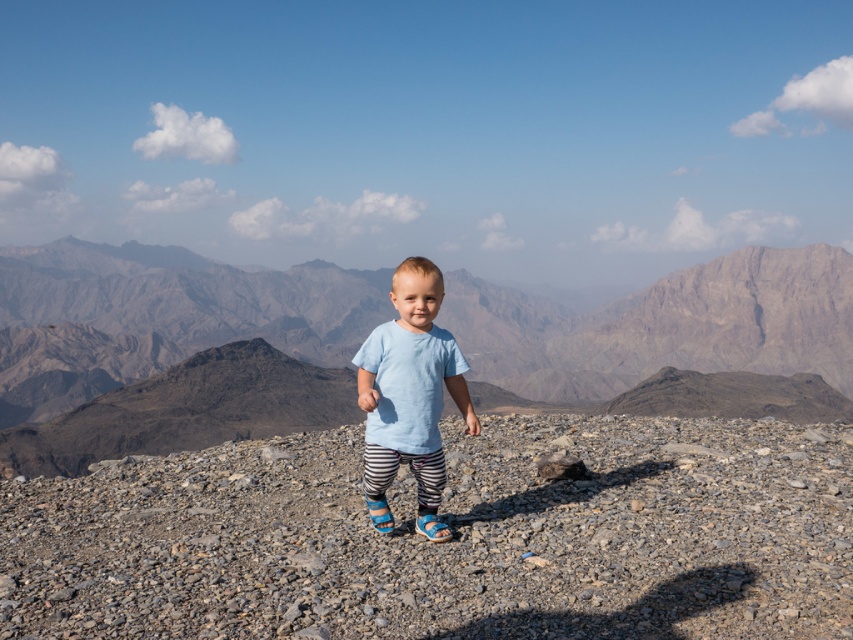
Is gray gravel at center behind light blue cotton shirt at center?

That is True.

Between gray gravel at center and light blue cotton shirt at center, which one is positioned higher?

light blue cotton shirt at center is higher up.

At what (x,y) coordinates should I click in order to perform the action: click on gray gravel at center. Please return your answer as a coordinate pair (x, y). The width and height of the screenshot is (853, 640). Looking at the image, I should click on (447, 541).